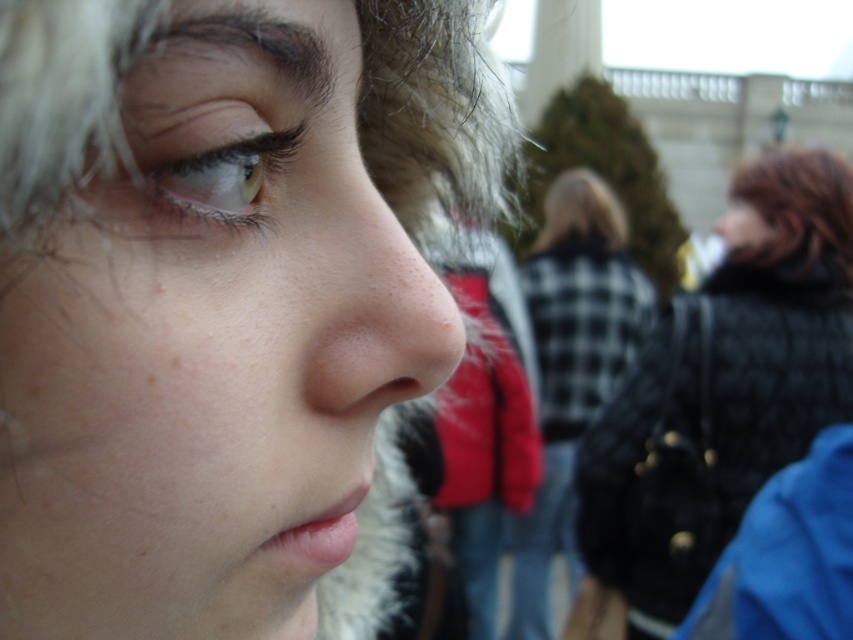
Question: Which point is closer to the camera?

Choices:
 (A) matte skin eye at center
 (B) blondehair at center
 (C) black quilted coat at upper right

Answer: (B)

Question: Can you confirm if plaid fabric coat at center is wider than smooth skin nose at center?

Choices:
 (A) no
 (B) yes

Answer: (B)

Question: Does smooth skin face at center appear on the left side of blonde hair at center?

Choices:
 (A) yes
 (B) no

Answer: (A)

Question: Considering the real-world distances, which object is farthest from the blonde hair at center?

Choices:
 (A) matte skin eye at center
 (B) blondehair at center

Answer: (A)

Question: Which of the following is the closest to the observer?

Choices:
 (A) plaid fabric coat at center
 (B) brown matte hair at upper right
 (C) smooth skin face at center

Answer: (C)

Question: Is smooth skin nose at center wider than matte skin eye at center?

Choices:
 (A) no
 (B) yes

Answer: (B)